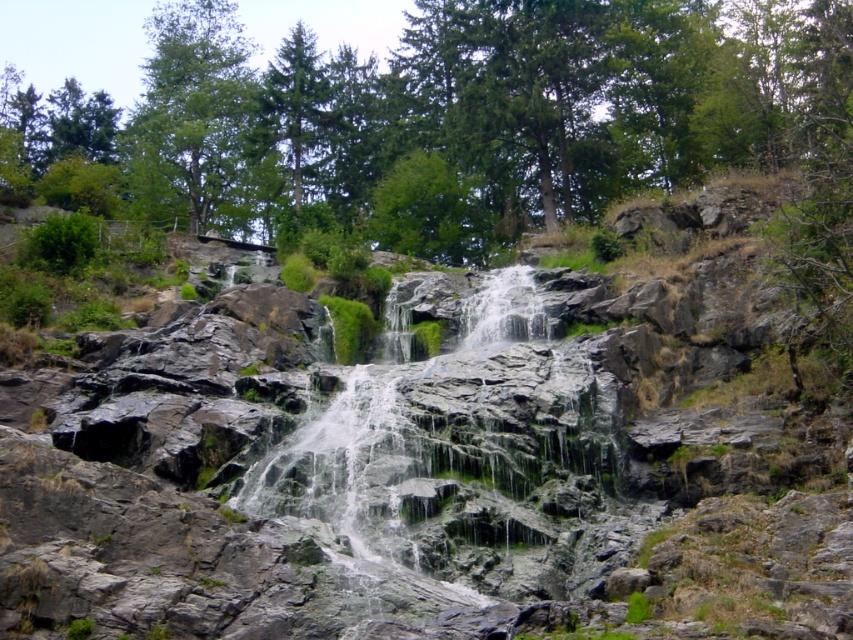
You are standing at the point marked by coordinates point (x=463, y=452). Looking around, you see the green mossy rock at center. Which direction should you walk to reach the nearest coniferous tree?

The nearest coniferous tree is located in the background, so you should walk forward from the point (x=463, y=452) towards the background to reach it.

You are a hiker standing at the edge of the waterfall. You notice two objects in the scene described as green mossy rocks at center and green mossy rock at center. Which of these two objects is wider?

The green mossy rocks at center is wider than the green mossy rock at center.

You are standing at the base of the waterfall and want to take a photo of the green mossy rock at center and the green leafy tree at upper left. Which object will appear closer to the camera in your photo?

→ The green mossy rock at center will appear closer to the camera because it is positioned in front of the green leafy tree at upper left.